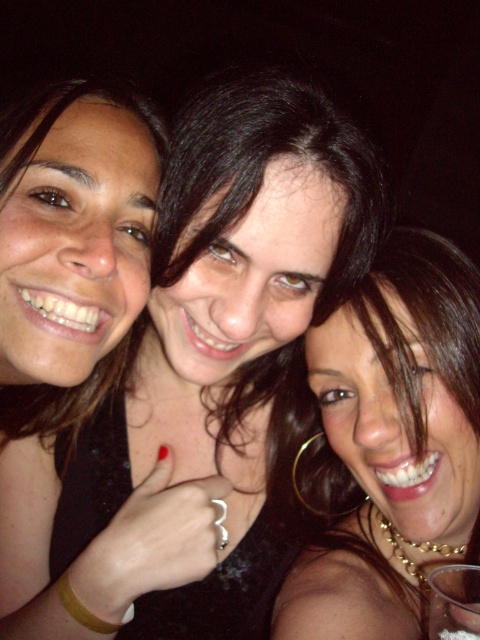
You are taking a photo of three people at night. The camera is positioned at a certain distance. The scene includes a point labeled as point [384,264]. Can you determine if this point is closer to the camera than 30 inches?

The distance between point [384,264] and the camera is 27.12 inches, which is less than 30 inches. Therefore, the point is closer to the camera than 30 inches.

You are taking a photo of two points in the image. The first point is at coordinates point (x=440, y=374) and the second is at point (x=435, y=589). Which point is closer to the camera?

Point (x=440, y=374) is further to the camera than point (x=435, y=589), so the second point is closer to the camera.

You are taking a photo with a camera. The camera is at a certain distance from a point labeled as point (465, 596). If you want to adjust the focus to ensure that this point is sharp in the photo, what is the minimum distance the camera should be from this point?

The camera should be at least 22.20 inches away from point (465, 596) to ensure it is in focus.